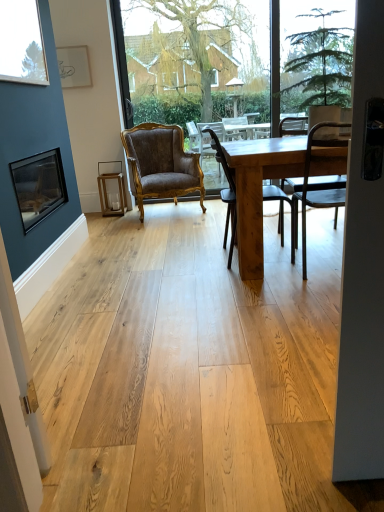
The image size is (384, 512). I want to click on free area in between black metal chair at right, the 1th chair positioned from the front, and natural wood table at center, so click(x=284, y=282).